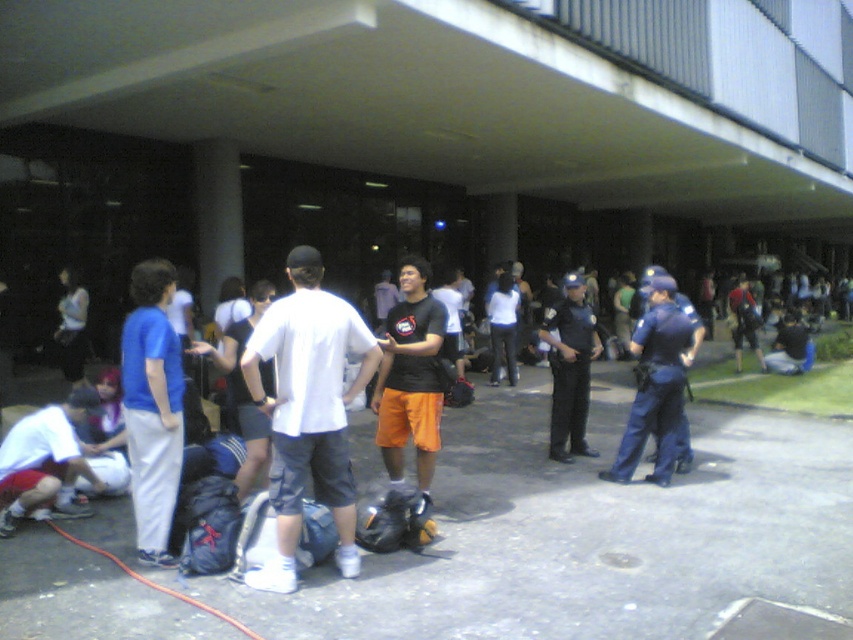
The image size is (853, 640). Find the location of `matte black t-shirt at center`. matte black t-shirt at center is located at coordinates 410,378.

Is matte black t-shirt at center bigger than white matte shirt at lower left?

Indeed, matte black t-shirt at center has a larger size compared to white matte shirt at lower left.

Who is more forward, (387, 332) or (76, 397)?

Positioned in front is point (76, 397).

This screenshot has height=640, width=853. What are the coordinates of `matte black t-shirt at center` in the screenshot? It's located at (410, 378).

Between blue uniform pants at center and rubber hose at lower left, which one has less height?

rubber hose at lower left is shorter.

The height and width of the screenshot is (640, 853). I want to click on blue uniform pants at center, so click(x=654, y=385).

In order to click on blue uniform pants at center in this screenshot , I will do `click(654, 385)`.

Based on the photo, is blue cotton shirt at left behind orange shorts at center?

No, blue cotton shirt at left is in front of orange shorts at center.

Is point (149, 356) positioned before point (732, 342)?

Yes.

Between point (126, 416) and point (735, 364), which one is positioned in front?

Point (126, 416) is in front.

Image resolution: width=853 pixels, height=640 pixels. What are the coordinates of `blue cotton shirt at left` in the screenshot? It's located at (152, 406).